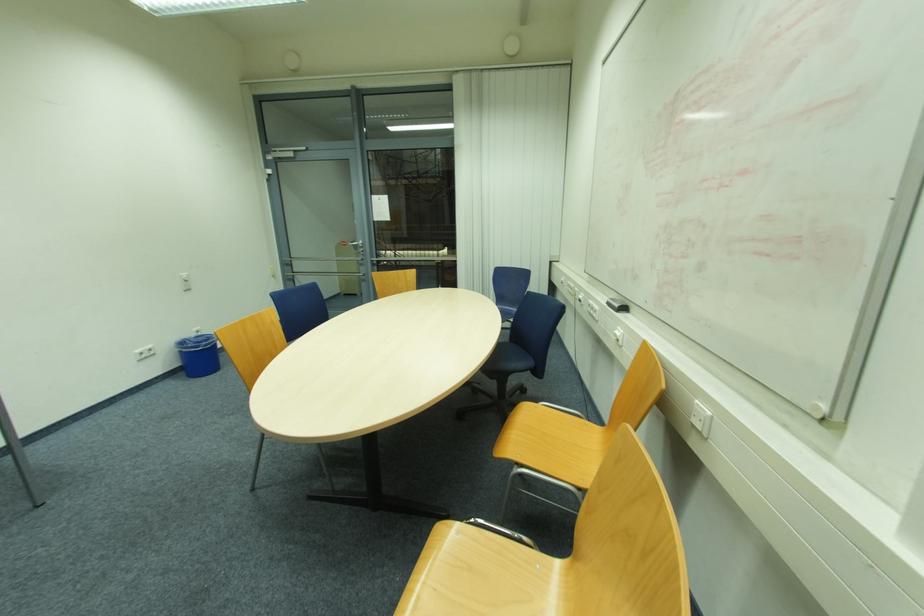
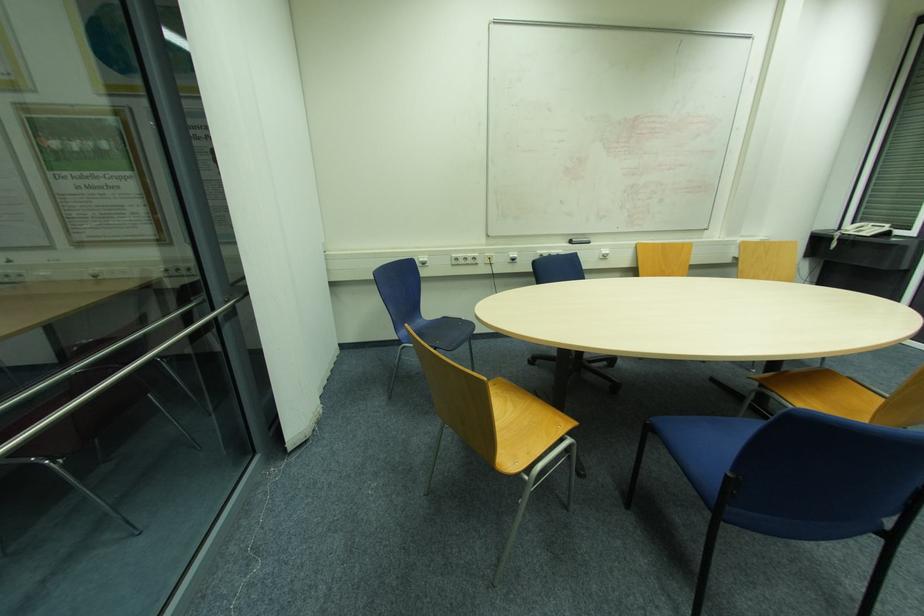
In the second image, find the point that corresponds to [617,331] in the first image.

(604, 253)